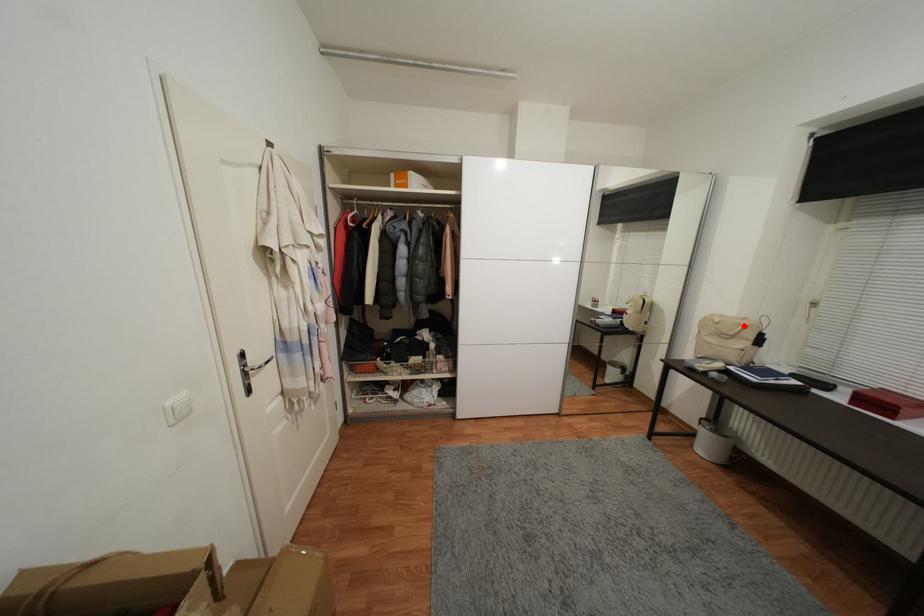
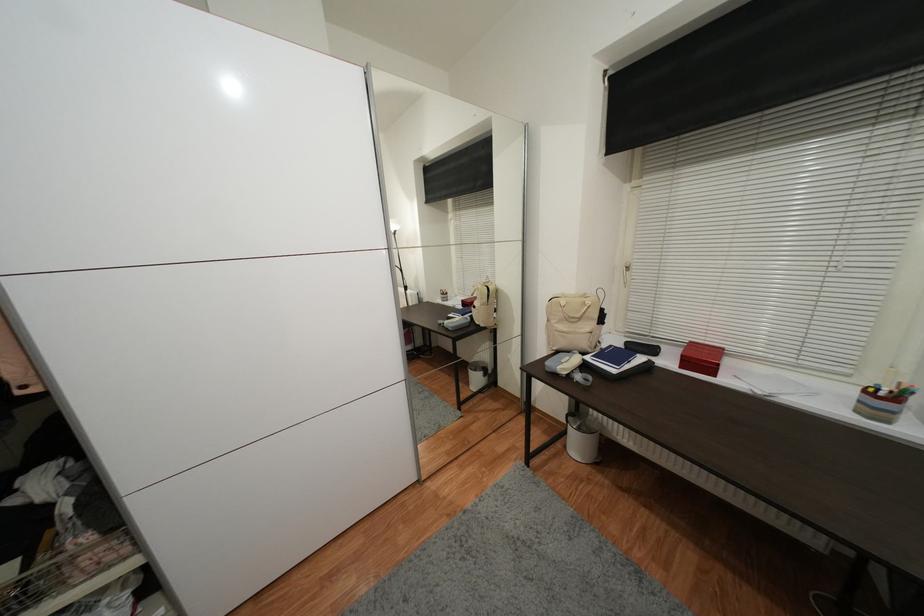
Find the pixel in the second image that matches the highlighted location in the first image.

(589, 305)